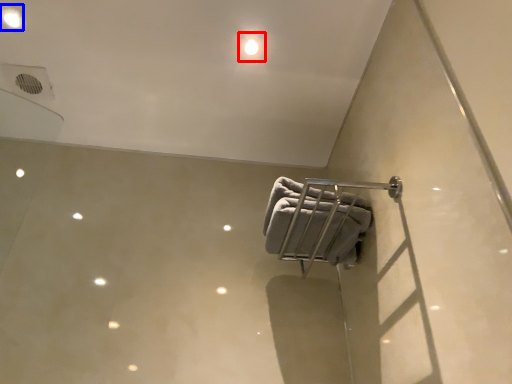
Question: Which of the following is the closest to the observer, dot (highlighted by a red box) or dot (highlighted by a blue box)?

Choices:
 (A) dot
 (B) dot

Answer: (B)